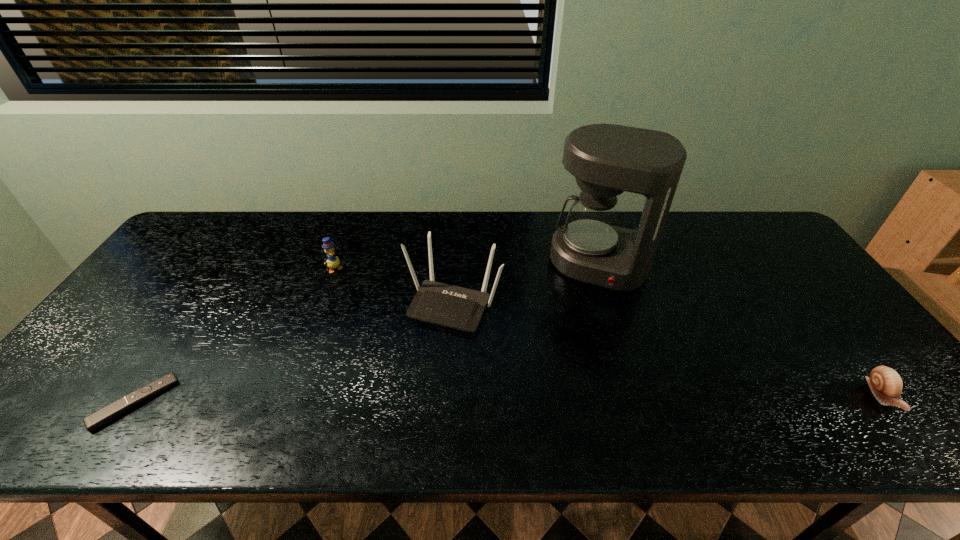
This screenshot has width=960, height=540. What are the coordinates of `object that is positioned at the far edge` in the screenshot? It's located at (606, 159).

This screenshot has width=960, height=540. I want to click on remote control situated at the near edge, so click(x=106, y=414).

What are the coordinates of `escargot present at the near edge` in the screenshot? It's located at (885, 383).

At what (x,y) coordinates should I click in order to perform the action: click on object that is at the left edge. Please return your answer as a coordinate pair (x, y). The image size is (960, 540). Looking at the image, I should click on (106, 414).

At what (x,y) coordinates should I click in order to perform the action: click on object located in the right edge section of the desktop. Please return your answer as a coordinate pair (x, y). Looking at the image, I should click on (885, 383).

Locate an element on the screen. object present at the near left corner is located at coordinates (106, 414).

The image size is (960, 540). Find the location of `object that is at the near right corner`. object that is at the near right corner is located at coordinates (885, 383).

In the image, there is a desktop. Where is `vacant space at the far edge`? The image size is (960, 540). vacant space at the far edge is located at coordinates (379, 228).

The height and width of the screenshot is (540, 960). I want to click on vacant space at the near edge of the desktop, so click(x=359, y=388).

The image size is (960, 540). I want to click on free space at the left edge, so click(x=188, y=298).